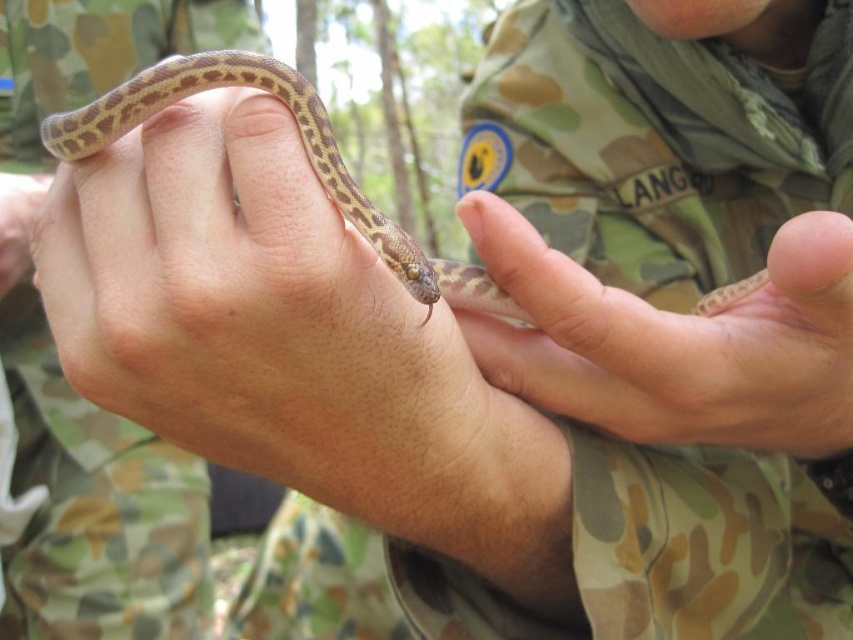
You are a wildlife photographer aiming to capture the snake in the image. Since the brown matte snake at center and the smooth skin hand at center are both in focus, which object is closer to your camera lens?

The brown matte snake at center is closer to the viewer than the smooth skin hand at center, so the snake would be in focus closer to the camera lens.

Based on the photo, you are a wildlife handler observing a person holding a snake in the forest. The person is wearing camouflage. You see the smooth skin hand at center and the brown spotted skin at center. Which object is supporting the other?

The smooth skin hand at center is positioned under brown spotted skin at center, so the hand is supporting the snake.

You are a wildlife researcher observing a person holding a snake in a forest. The person is wearing camouflage and has a brown matte snake at center and a smooth skin hand at center. Which object is taller?

The brown matte snake at center is much taller than the smooth skin hand at center.